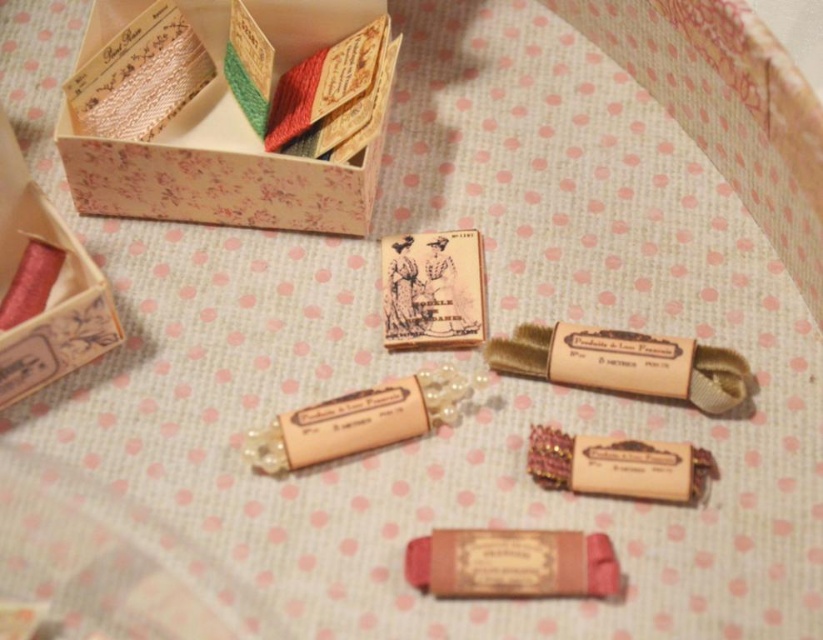
Question: Is matte pink wood box at left above beige fabric roll at center?

Choices:
 (A) yes
 (B) no

Answer: (A)

Question: Can you confirm if matte pink wood box at left is positioned above matte pink thread at center?

Choices:
 (A) yes
 (B) no

Answer: (A)

Question: Which object appears farthest from the camera in this image?

Choices:
 (A) beige fabric roll at center
 (B) floral paper box at upper left

Answer: (B)

Question: Does matte pink wood box at left appear on the right side of pearlized paper thread at center?

Choices:
 (A) no
 (B) yes

Answer: (A)

Question: Which object appears closest to the camera in this image?

Choices:
 (A) floral paper box at upper left
 (B) matte pink thread at center

Answer: (B)

Question: Which point is farther to the camera?

Choices:
 (A) (463, 536)
 (B) (81, 332)
 (C) (346, 410)
 (D) (105, 12)

Answer: (D)